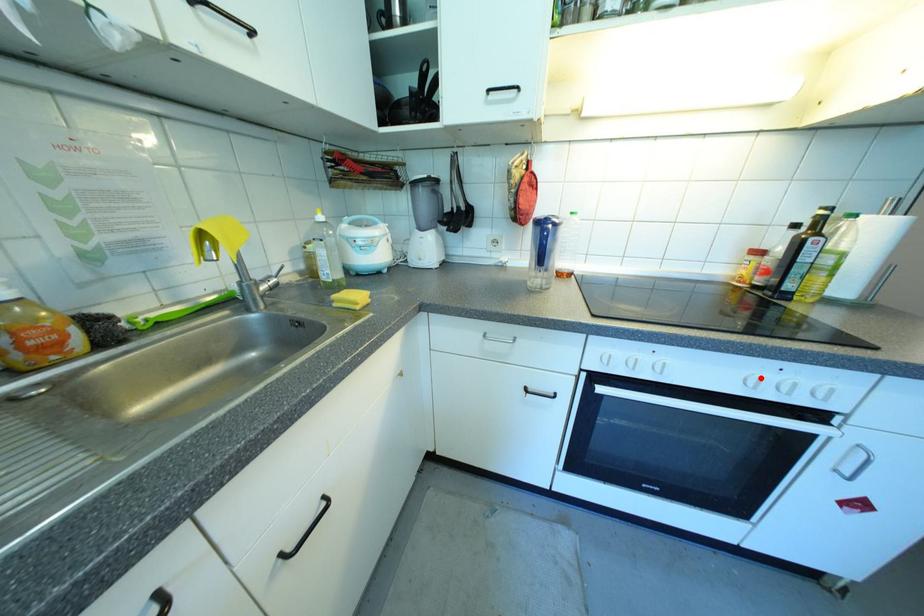
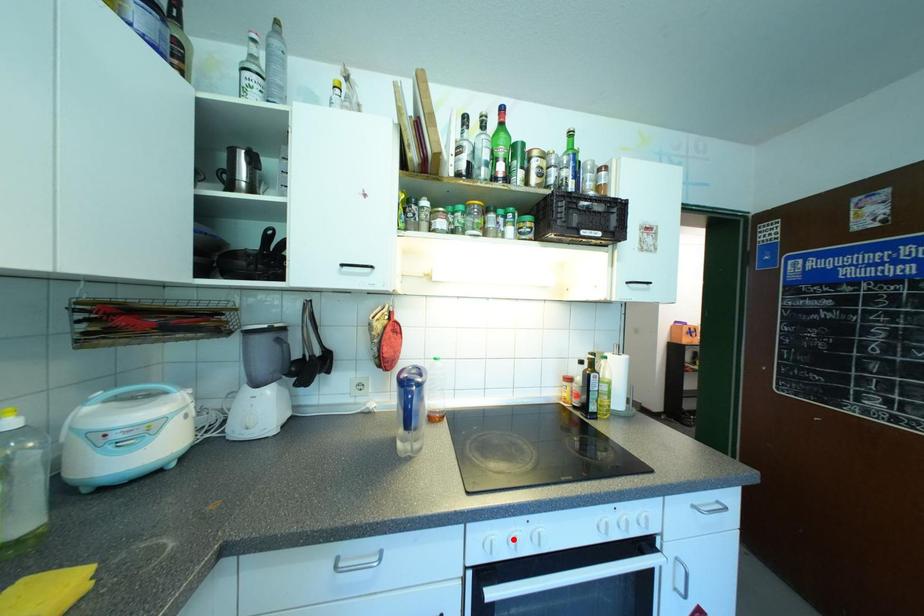
I am providing you with two images of the same scene from different viewpoints. A red point is marked on the first image and another point is marked on the second image. Do the highlighted points in image1 and image2 indicate the same real-world spot?

No